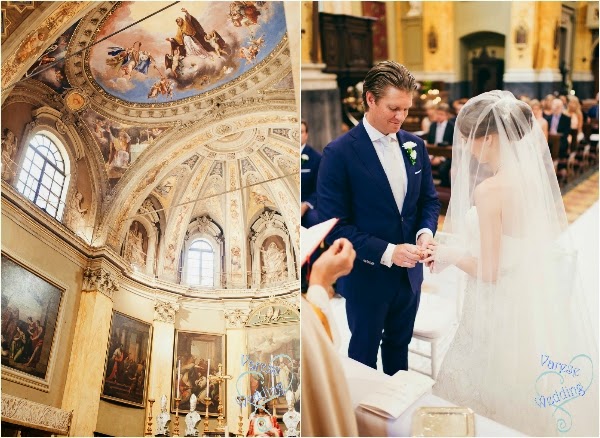
Identify the location of corinthian pillar cap. (111, 280).